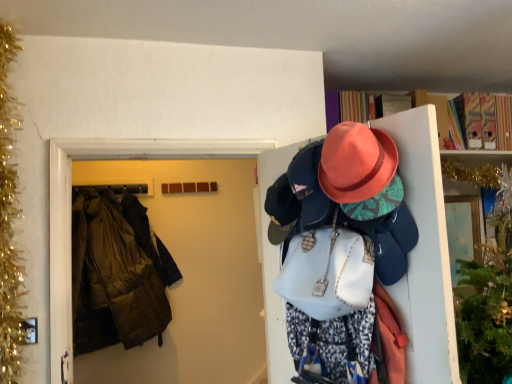
Question: Considering the relative sizes of gold tinsel garland at left and brown fabric coat at left in the image provided, is gold tinsel garland at left taller than brown fabric coat at left?

Choices:
 (A) no
 (B) yes

Answer: (B)

Question: From a real-world perspective, is gold tinsel garland at left physically below brown fabric coat at left?

Choices:
 (A) no
 (B) yes

Answer: (A)

Question: From the image's perspective, is gold tinsel garland at left located above brown fabric coat at left?

Choices:
 (A) yes
 (B) no

Answer: (A)

Question: Is gold tinsel garland at left oriented towards brown fabric coat at left?

Choices:
 (A) yes
 (B) no

Answer: (B)

Question: Considering the relative positions of gold tinsel garland at left and brown fabric coat at left in the image provided, is gold tinsel garland at left in front of brown fabric coat at left?

Choices:
 (A) no
 (B) yes

Answer: (B)

Question: Is gold tinsel garland at left at the right side of brown fabric coat at left?

Choices:
 (A) yes
 (B) no

Answer: (B)

Question: From a real-world perspective, is matte pink hat at upper right positioned over dark brown leather jacket at left based on gravity?

Choices:
 (A) no
 (B) yes

Answer: (A)

Question: Can you confirm if matte pink hat at upper right is wider than dark brown leather jacket at left?

Choices:
 (A) no
 (B) yes

Answer: (B)

Question: Is matte pink hat at upper right to the left of dark brown leather jacket at left from the viewer's perspective?

Choices:
 (A) yes
 (B) no

Answer: (B)

Question: Does matte pink hat at upper right have a lesser height compared to dark brown leather jacket at left?

Choices:
 (A) no
 (B) yes

Answer: (A)

Question: Is matte pink hat at upper right completely or partially outside of dark brown leather jacket at left?

Choices:
 (A) yes
 (B) no

Answer: (A)

Question: Is the surface of matte pink hat at upper right in direct contact with dark brown leather jacket at left?

Choices:
 (A) yes
 (B) no

Answer: (B)

Question: From a real-world perspective, is matte pink hat at upper right located higher than gold tinsel garland at left?

Choices:
 (A) yes
 (B) no

Answer: (B)